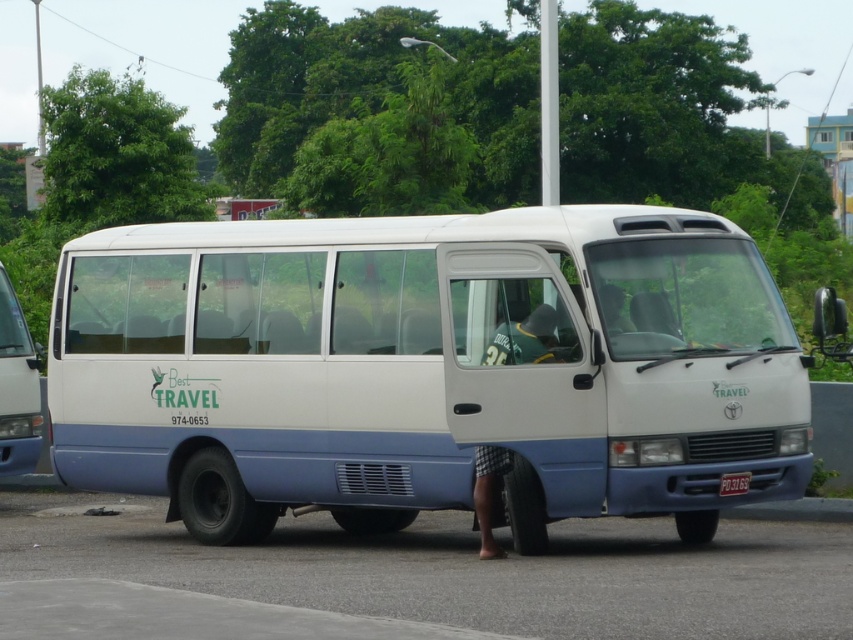
Question: Where is white matte van at center located in relation to green jersey at center in the image?

Choices:
 (A) right
 (B) left

Answer: (B)

Question: Does white matte van at center appear over white plastic license plate at center?

Choices:
 (A) no
 (B) yes

Answer: (B)

Question: Which point is farther to the camera?

Choices:
 (A) white matte van at center
 (B) white plastic license plate at center
 (C) white matte van at left

Answer: (C)

Question: Can you confirm if green jersey at center is positioned above white plastic license plate at center?

Choices:
 (A) no
 (B) yes

Answer: (A)

Question: Considering the real-world distances, which object is closest to the white plastic license plate at center?

Choices:
 (A) green jersey at center
 (B) white matte van at left
 (C) white matte van at center

Answer: (A)

Question: Which object appears closest to the camera in this image?

Choices:
 (A) white matte van at left
 (B) green jersey at center
 (C) white matte van at center

Answer: (C)